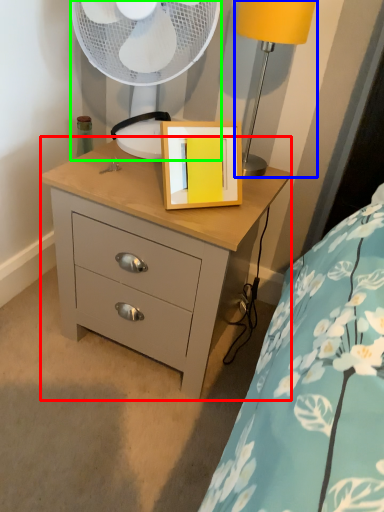
Question: Which object is the farthest from chest of drawers (highlighted by a red box)? Choose among these: table lamp (highlighted by a blue box) or mechanical fan (highlighted by a green box).

Choices:
 (A) table lamp
 (B) mechanical fan

Answer: (A)